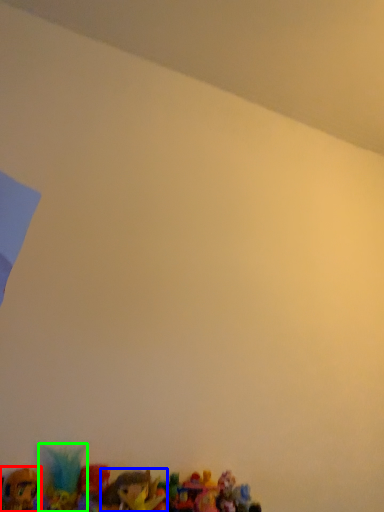
Question: Considering the real-world distances, which object is farthest from toy (highlighted by a red box)? toy (highlighted by a blue box) or toy (highlighted by a green box)?

Choices:
 (A) toy
 (B) toy

Answer: (A)